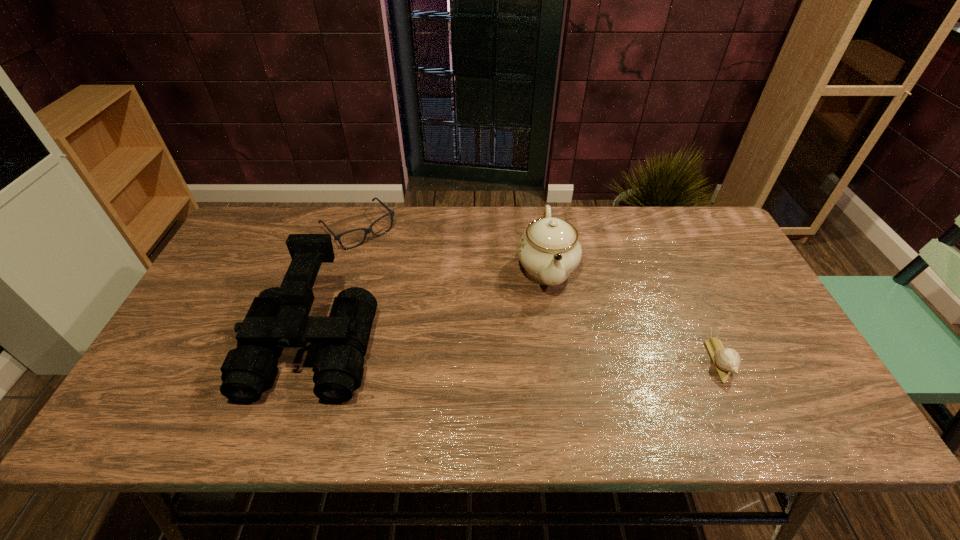
I want to click on vacant space located 0.230m at the spout of the chinaware, so click(562, 375).

Find the location of a particular element. This screenshot has width=960, height=540. spectacles present at the far edge is located at coordinates (367, 230).

Find the location of `chinaware at the far edge`. chinaware at the far edge is located at coordinates (549, 250).

The width and height of the screenshot is (960, 540). I want to click on binoculars positioned at the near edge, so click(x=278, y=318).

The height and width of the screenshot is (540, 960). I want to click on escargot at the near edge, so click(x=726, y=360).

Where is `vacant space at the far edge`? The image size is (960, 540). vacant space at the far edge is located at coordinates (582, 226).

This screenshot has width=960, height=540. I want to click on vacant space at the near edge of the desktop, so click(719, 379).

This screenshot has height=540, width=960. What are the coordinates of `vacant space at the left edge of the desktop` in the screenshot? It's located at (204, 361).

In the image, there is a desktop. What are the coordinates of `vacant space at the right edge` in the screenshot? It's located at (689, 255).

In order to click on free region at the far left corner in this screenshot , I will do `click(258, 230)`.